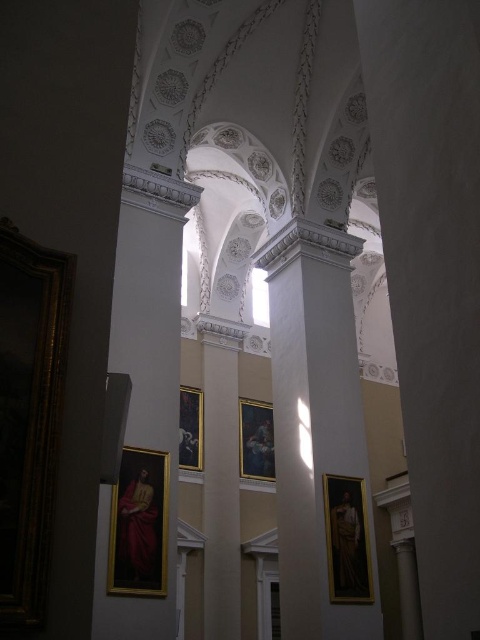
Who is positioned more to the left, gold-framed portrait at center or matte gold picture frame at center?

From the viewer's perspective, matte gold picture frame at center appears more on the left side.

Who is more distant from viewer, (331,500) or (263,448)?

The point (263,448) is behind.

Identify the location of gold-framed portrait at center. (347, 540).

Which is above, matte gold picture frame at center or black glossy picture frame at center?

black glossy picture frame at center is above.

Is matte gold picture frame at center to the right of black glossy picture frame at center from the viewer's perspective?

Correct, you'll find matte gold picture frame at center to the right of black glossy picture frame at center.

The height and width of the screenshot is (640, 480). In order to click on matte gold picture frame at center in this screenshot , I will do `click(255, 440)`.

At what (x,y) coordinates should I click in order to perform the action: click on matte gold picture frame at center. Please return your answer as a coordinate pair (x, y). Looking at the image, I should click on (255, 440).

Is point (28, 600) positioned in front of point (183, 408)?

That is True.

Is gold ornate picture frame at left taller than black glossy picture frame at center?

Indeed, gold ornate picture frame at left has a greater height compared to black glossy picture frame at center.

Does point (45, 552) come farther from viewer compared to point (180, 436)?

No, (45, 552) is closer to viewer.

Where is `gold ornate picture frame at left`? gold ornate picture frame at left is located at coordinates (28, 417).